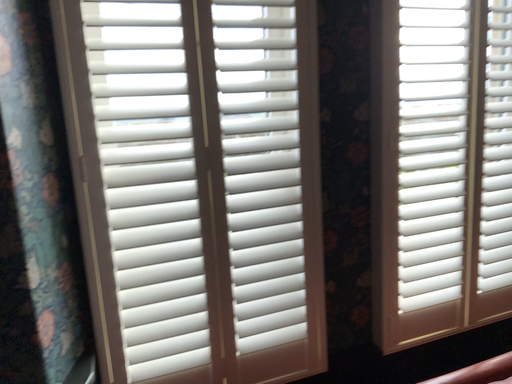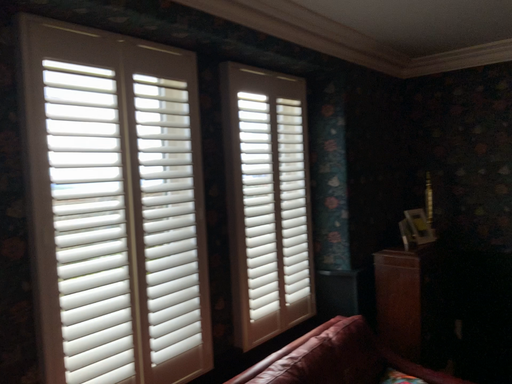
Question: Which way did the camera rotate in the video?

Choices:
 (A) rotated left
 (B) rotated right

Answer: (B)